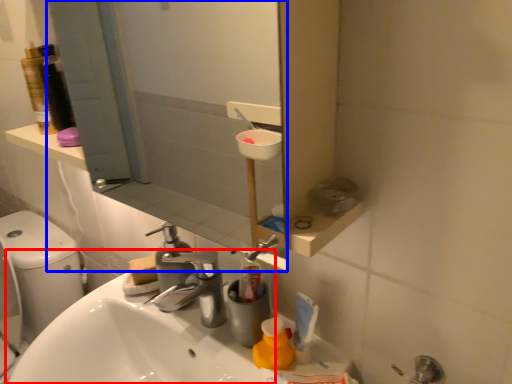
Question: Among these objects, which one is nearest to the camera, sink (highlighted by a red box) or mirror (highlighted by a blue box)?

Choices:
 (A) sink
 (B) mirror

Answer: (B)